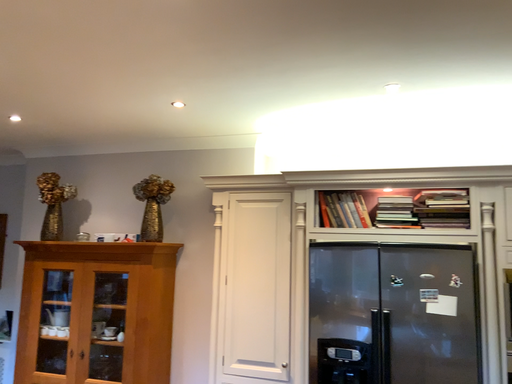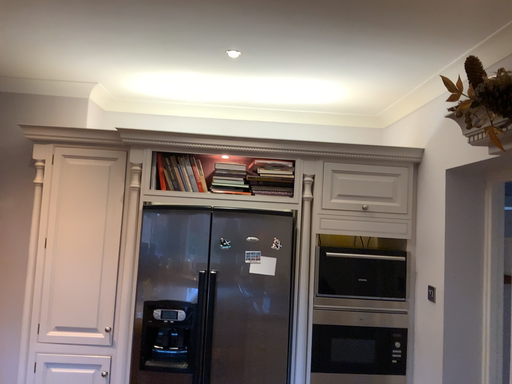
Question: How did the camera likely rotate when shooting the video?

Choices:
 (A) rotated left
 (B) rotated right

Answer: (B)